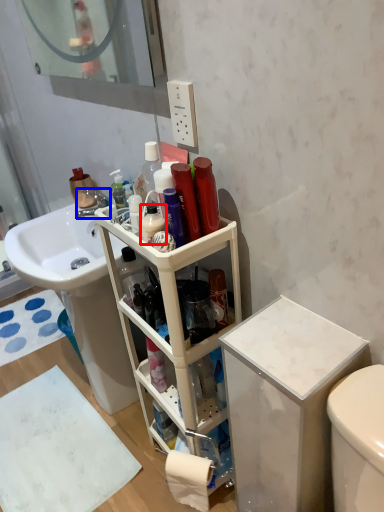
Question: Which of the following is the closest to the observer, cleaning product (highlighted by a red box) or faucet (highlighted by a blue box)?

Choices:
 (A) cleaning product
 (B) faucet

Answer: (A)